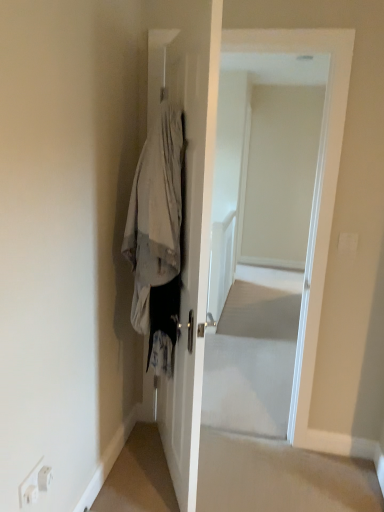
The image size is (384, 512). Describe the element at coordinates (157, 238) in the screenshot. I see `denim jacket at center` at that location.

The width and height of the screenshot is (384, 512). Identify the location of denim jacket at center. tap(157, 238).

Image resolution: width=384 pixels, height=512 pixels. In order to click on white glossy door at center in this screenshot , I will do `click(260, 234)`.

The width and height of the screenshot is (384, 512). Describe the element at coordinates (260, 234) in the screenshot. I see `white glossy door at center` at that location.

At what (x,y) coordinates should I click in order to perform the action: click on denim jacket at center. Please return your answer as a coordinate pair (x, y). This screenshot has width=384, height=512. Looking at the image, I should click on tap(157, 238).

Would you say white glossy door at center is to the left or to the right of denim jacket at center in the picture?

Based on their positions, white glossy door at center is located to the right of denim jacket at center.

Is white glossy door at center positioned behind denim jacket at center?

Yes.

Which point is more forward, (274,425) or (171,213)?

The point (171,213) is closer to the camera.

From the image's perspective, is white glossy door at center above or below denim jacket at center?

Clearly, from the image's perspective, white glossy door at center is above denim jacket at center.

From a real-world perspective, relative to denim jacket at center, is white glossy door at center vertically above or below?

white glossy door at center is situated lower than denim jacket at center in the real world.

In the scene shown: Is white glossy door at center wider than denim jacket at center?

In fact, white glossy door at center might be narrower than denim jacket at center.

Considering the relative sizes of white glossy door at center and denim jacket at center in the image provided, is white glossy door at center taller than denim jacket at center?

Yes, white glossy door at center is taller than denim jacket at center.

Looking at the image, does white glossy door at center seem bigger or smaller compared to denim jacket at center?

Considering their sizes, white glossy door at center takes up more space than denim jacket at center.

Would you say white glossy door at center is inside or outside denim jacket at center?

white glossy door at center lies outside denim jacket at center.

Is white glossy door at center far away from denim jacket at center?

Indeed, white glossy door at center is not near denim jacket at center.

In the scene shown: Is denim jacket at center at the back of white glossy door at center?

No, denim jacket at center is not at the back of white glossy door at center.

How far apart are white glossy door at center and denim jacket at center?

7.27 feet.

The height and width of the screenshot is (512, 384). Identify the location of clothing below the white glossy door at center (from the image's perspective). coord(157,238).

Between denim jacket at center and white glossy door at center, which one appears on the right side from the viewer's perspective?

white glossy door at center is more to the right.

Is denim jacket at center behind white glossy door at center?

No, it is not.

Considering the positions of point (155, 124) and point (259, 237), is point (155, 124) closer or farther from the camera than point (259, 237)?

Clearly, point (155, 124) is closer to the camera than point (259, 237).

From the image's perspective, does denim jacket at center appear higher than white glossy door at center?

No, from the image's perspective, denim jacket at center is not over white glossy door at center.

From a real-world perspective, is denim jacket at center located beneath white glossy door at center?

Incorrect, from a real-world perspective, denim jacket at center is higher than white glossy door at center.

Considering the relative sizes of denim jacket at center and white glossy door at center in the image provided, is denim jacket at center wider than white glossy door at center?

Yes, denim jacket at center is wider than white glossy door at center.

From the picture: Who is shorter, denim jacket at center or white glossy door at center?

denim jacket at center.

Considering the relative sizes of denim jacket at center and white glossy door at center in the image provided, is denim jacket at center bigger than white glossy door at center?

Actually, denim jacket at center might be smaller than white glossy door at center.

From the picture: Would you say denim jacket at center is inside or outside white glossy door at center?

denim jacket at center is not inside white glossy door at center, it's outside.

Is denim jacket at center next to white glossy door at center?

No.

Is denim jacket at center positioned with its back to white glossy door at center?

denim jacket at center does not have its back to white glossy door at center.

Where is `clothing on the left of white glossy door at center`? clothing on the left of white glossy door at center is located at coordinates (157, 238).

At what (x,y) coordinates should I click in order to perform the action: click on screen door on the right of the denim jacket at center. Please return your answer as a coordinate pair (x, y). The image size is (384, 512). Looking at the image, I should click on (260, 234).

Identify the location of screen door above the denim jacket at center (from the image's perspective). coord(260,234).